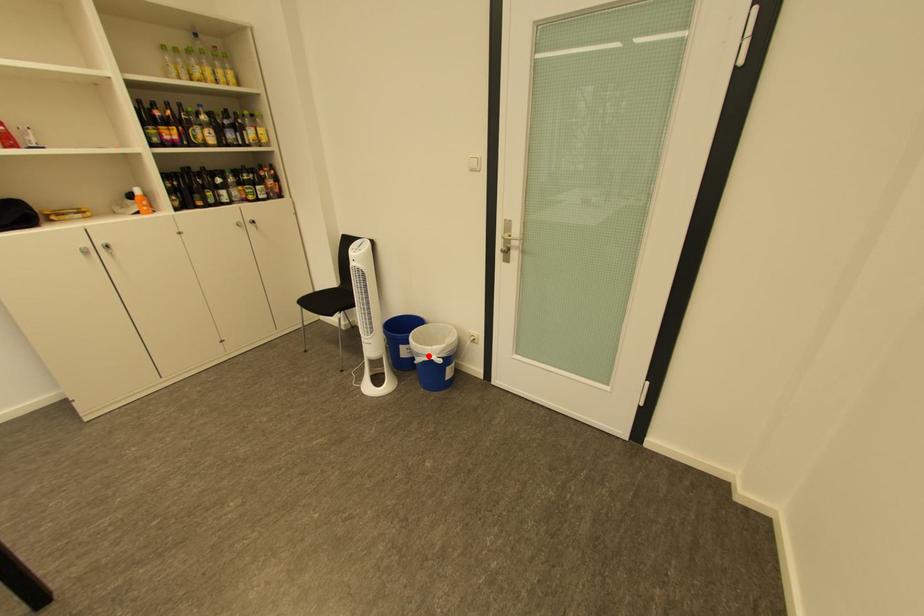
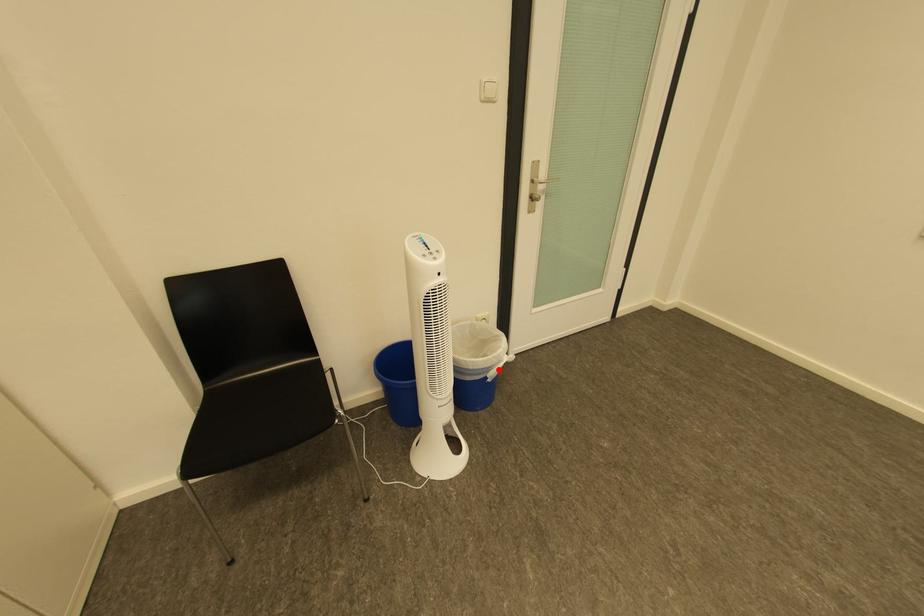
I am providing you with two images of the same scene from different viewpoints. A red point is marked on the first image and another point is marked on the second image. Does the point marked in image1 correspond to the same location as the one in image2?

Yes